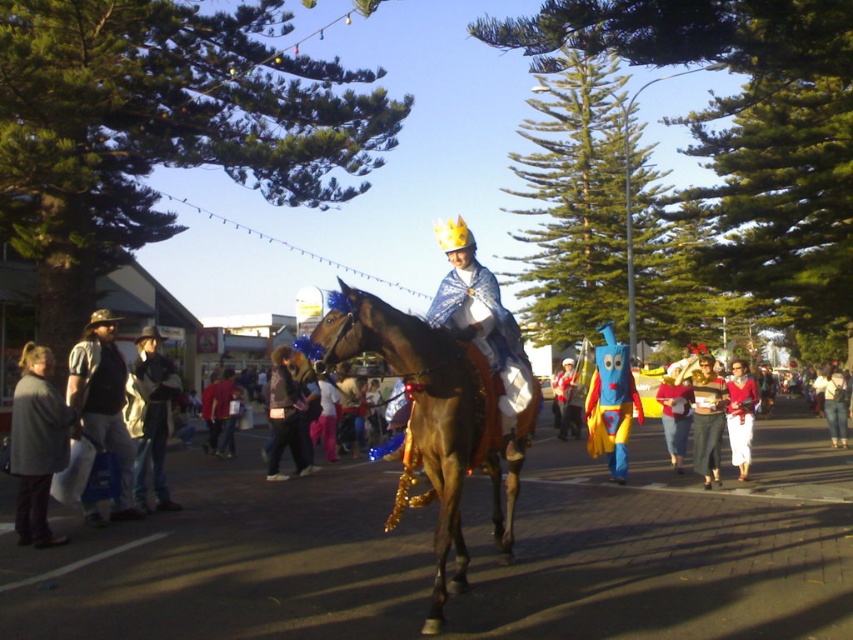
Question: Is brown shiny horse at center smaller than brushed metal vest at left?

Choices:
 (A) no
 (B) yes

Answer: (A)

Question: Among these objects, which one is nearest to the camera?

Choices:
 (A) brown shiny horse at center
 (B) brushed metal vest at left

Answer: (A)

Question: Does brown shiny horse at center appear over brushed metal vest at left?

Choices:
 (A) yes
 (B) no

Answer: (B)

Question: Which point appears closest to the camera in this image?

Choices:
 (A) (102, 428)
 (B) (451, 412)

Answer: (B)

Question: Does brown shiny horse at center have a greater width compared to brushed metal vest at left?

Choices:
 (A) no
 (B) yes

Answer: (B)

Question: Among these objects, which one is nearest to the camera?

Choices:
 (A) brown shiny horse at center
 (B) brushed metal vest at left

Answer: (A)